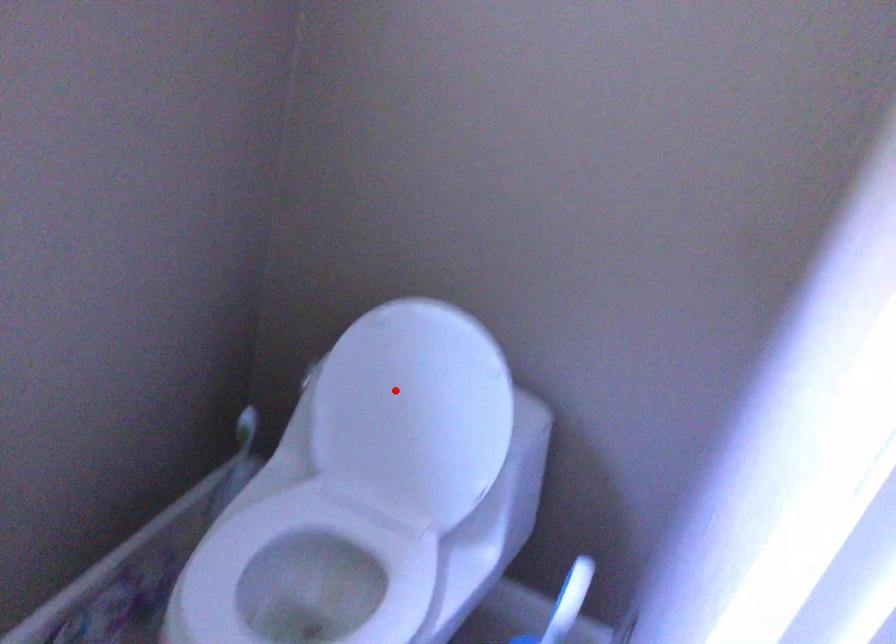
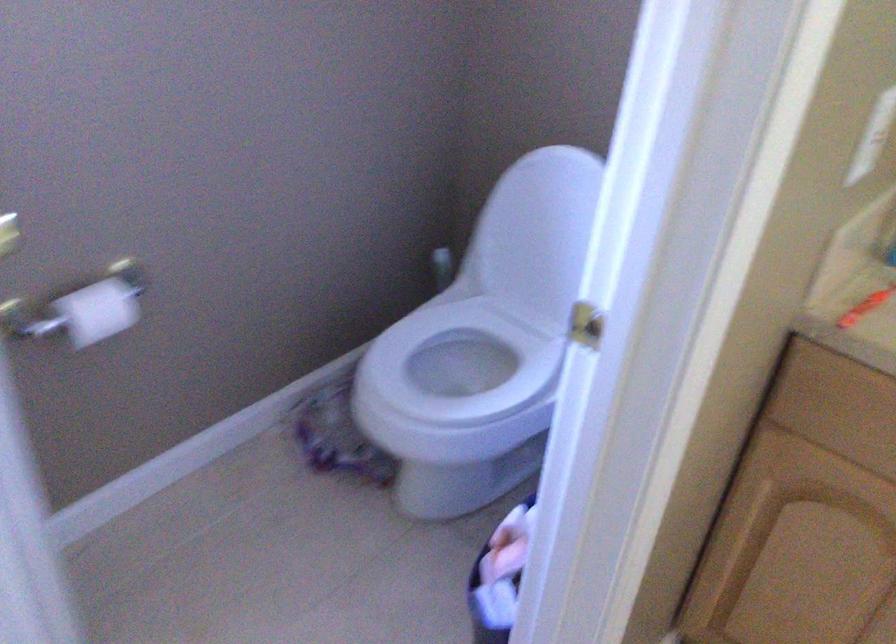
Question: I am providing you with two images of the same scene from different viewpoints. A red point is marked on the first image. Is the red point's position out of view in image 2?

Choices:
 (A) Yes
 (B) No

Answer: (B)